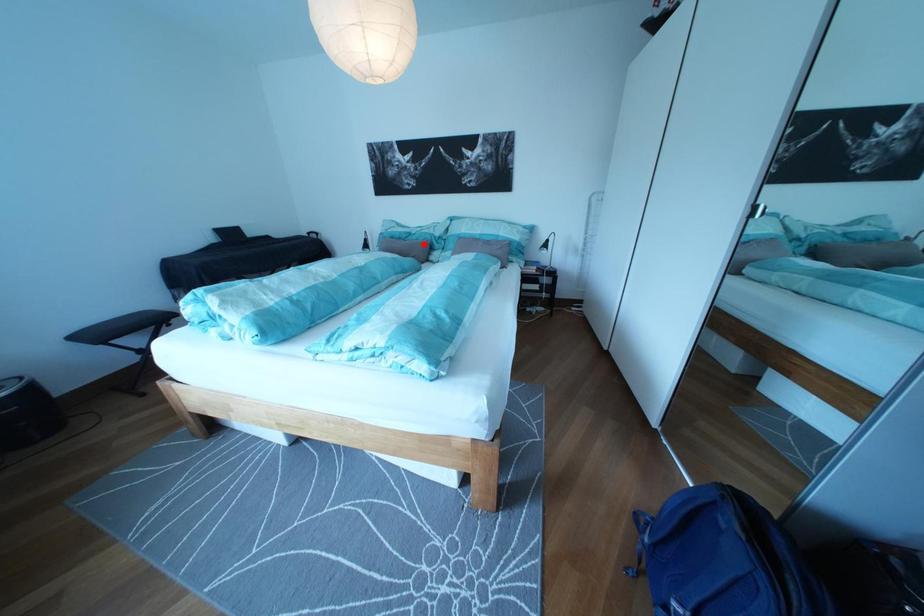
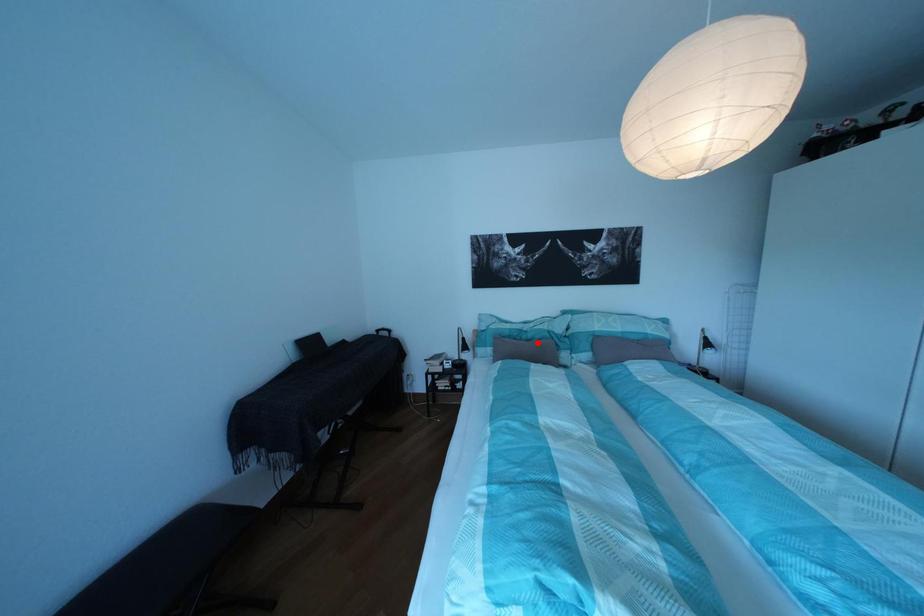
I am providing you with two images of the same scene from different viewpoints. A red point is marked on the first image and another point is marked on the second image. Does the point marked in image1 correspond to the same location as the one in image2?

Yes